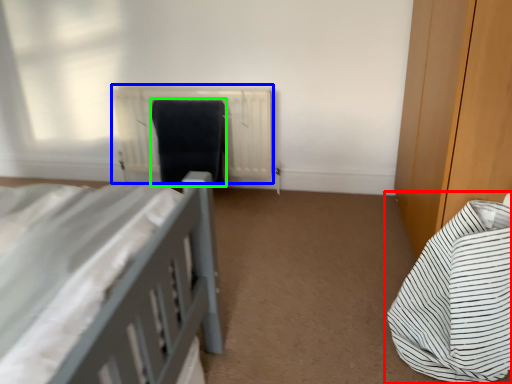
Question: Which is farther away from bed (highlighted by a red box)? radiator (highlighted by a blue box) or laundry (highlighted by a green box)?

Choices:
 (A) radiator
 (B) laundry

Answer: (B)